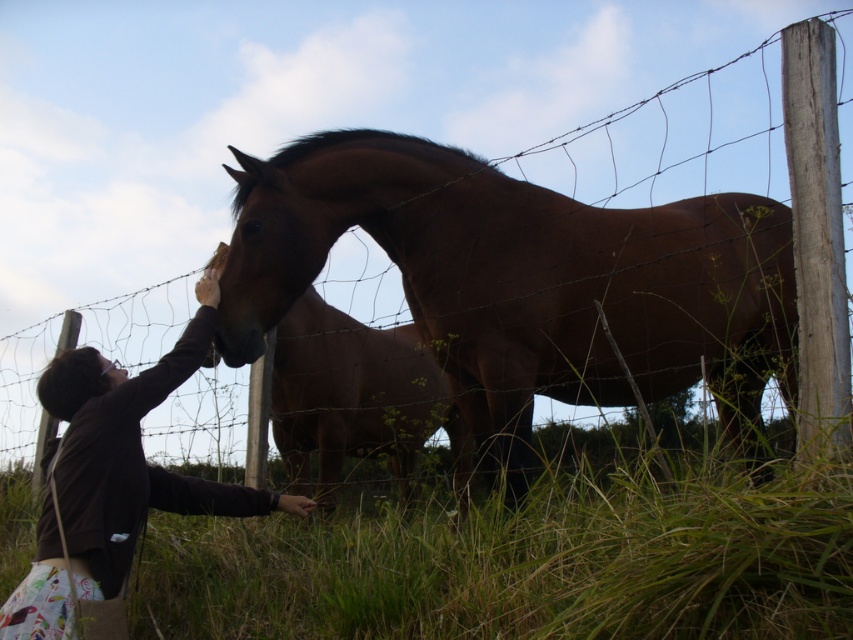
Can you confirm if green grass at lower center is smaller than dark brown sweater at left?

Incorrect, green grass at lower center is not smaller in size than dark brown sweater at left.

Is point (253, 600) closer to viewer compared to point (99, 560)?

No, it is not.

This screenshot has width=853, height=640. I want to click on green grass at lower center, so click(521, 564).

Does brown glossy horse at center have a larger size compared to dark brown sweater at left?

Yes, brown glossy horse at center is bigger than dark brown sweater at left.

Is brown glossy horse at center to the right of dark brown sweater at left from the viewer's perspective?

Indeed, brown glossy horse at center is positioned on the right side of dark brown sweater at left.

What do you see at coordinates (524, 282) in the screenshot?
I see `brown glossy horse at center` at bounding box center [524, 282].

At what (x,y) coordinates should I click in order to perform the action: click on brown glossy horse at center. Please return your answer as a coordinate pair (x, y). This screenshot has width=853, height=640. Looking at the image, I should click on (524, 282).

Is the position of brown glossy horse at center more distant than that of green grass at lower center?

Yes, brown glossy horse at center is further from the viewer.

Is brown glossy horse at center bigger than green grass at lower center?

No, brown glossy horse at center is not bigger than green grass at lower center.

Who is more forward, (525,186) or (1,548)?

Positioned in front is point (525,186).

This screenshot has height=640, width=853. Find the location of `brown glossy horse at center`. brown glossy horse at center is located at coordinates (524, 282).